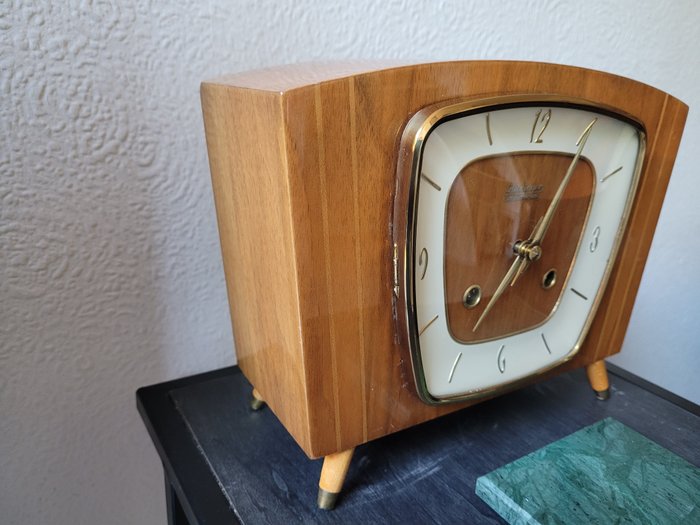
Where is `top left edge of black cabinet`? top left edge of black cabinet is located at coordinates (141, 391).